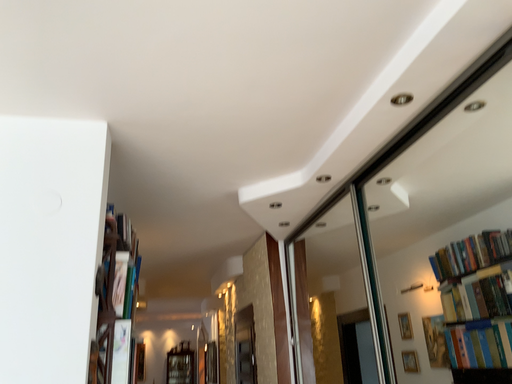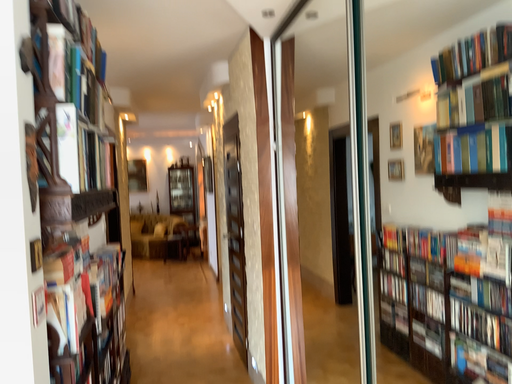
Question: Which way did the camera rotate in the video?

Choices:
 (A) rotated downward
 (B) rotated upward

Answer: (A)